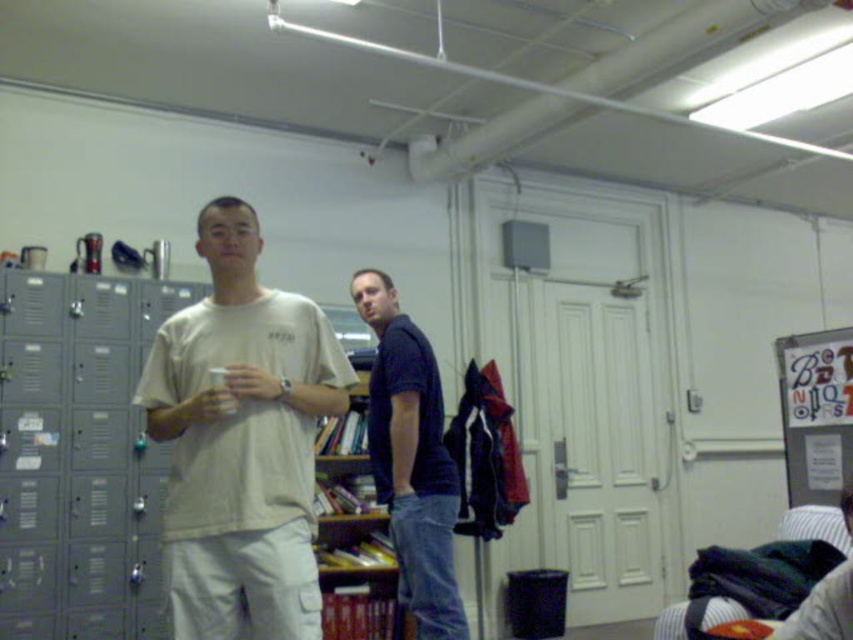
Who is shorter, light beige cotton t-shirt at center or wooden bookshelf at center?

light beige cotton t-shirt at center

Which is more to the right, light beige cotton t-shirt at center or wooden bookshelf at center?

wooden bookshelf at center is more to the right.

Between point (267, 577) and point (322, 428), which one is positioned in front?

Positioned in front is point (267, 577).

This screenshot has height=640, width=853. Find the location of `light beige cotton t-shirt at center`. light beige cotton t-shirt at center is located at coordinates (241, 442).

Who is lower down, dark blue shirt at center or wooden bookshelf at center?

wooden bookshelf at center

Is dark blue shirt at center taller than wooden bookshelf at center?

In fact, dark blue shirt at center may be shorter than wooden bookshelf at center.

What do you see at coordinates (410, 460) in the screenshot?
I see `dark blue shirt at center` at bounding box center [410, 460].

The width and height of the screenshot is (853, 640). In order to click on dark blue shirt at center in this screenshot , I will do `click(410, 460)`.

Can you confirm if light beige cotton t-shirt at center is taller than dark blue shirt at center?

No.

Does point (154, 349) lie in front of point (432, 458)?

Yes, point (154, 349) is in front of point (432, 458).

Identify the location of light beige cotton t-shirt at center. This screenshot has width=853, height=640. (241, 442).